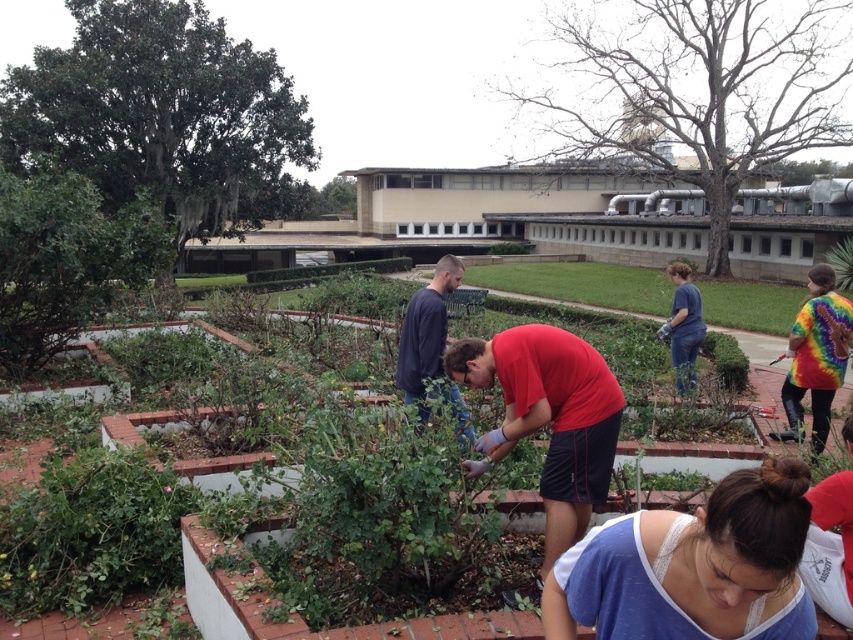
You are a photographer taking a picture of the garden scene. You want to ensure both the blue lace tank top at lower center and the red matte shirt at center are visible in the frame. Which clothing item is closer to the camera?

The blue lace tank top at lower center is positioned under the red matte shirt at center, meaning it is closer to the camera since it appears below and in front of the other.